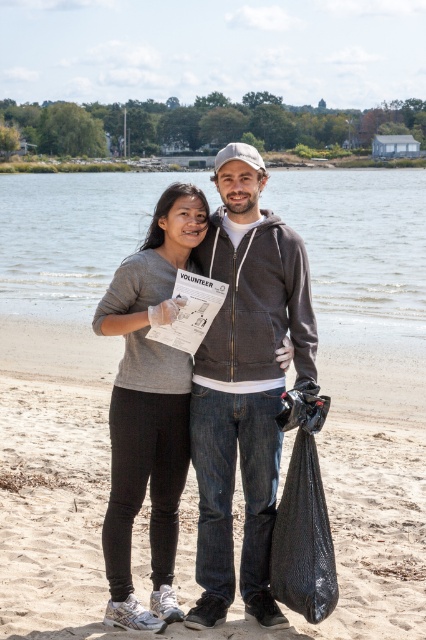
Does dark gray hoodie at center have a lesser width compared to matte gray sweatshirt at center?

No, dark gray hoodie at center is not thinner than matte gray sweatshirt at center.

Between dark gray hoodie at center and matte gray sweatshirt at center, which one is positioned higher?

dark gray hoodie at center is above.

Which is in front, point (247, 170) or point (134, 340)?

Point (247, 170)

Locate an element on the screen. This screenshot has height=640, width=426. dark gray hoodie at center is located at coordinates (244, 385).

Who is taller, clear water at center or matte gray sweatshirt at center?

clear water at center is taller.

Between point (420, 288) and point (178, 352), which one is positioned behind?

Positioned behind is point (420, 288).

This screenshot has width=426, height=640. Identify the location of clear water at center. (359, 243).

Does sandy beach at center appear under black plastic bag at lower right?

Yes.

Is sandy beach at center smaller than black plastic bag at lower right?

Result: Indeed, sandy beach at center has a smaller size compared to black plastic bag at lower right.

Image resolution: width=426 pixels, height=640 pixels. In order to click on sandy beach at center in this screenshot , I will do `click(54, 509)`.

Locate an element on the screen. The width and height of the screenshot is (426, 640). sandy beach at center is located at coordinates (54, 509).